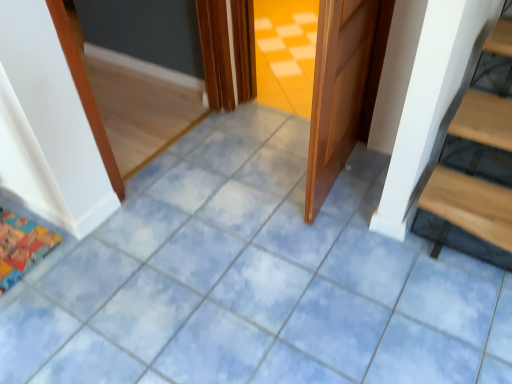
Describe the element at coordinates (21, 246) in the screenshot. The image size is (512, 384). I see `cartoon fabric mat at lower left` at that location.

The image size is (512, 384). I want to click on cartoon fabric mat at lower left, so click(21, 246).

The height and width of the screenshot is (384, 512). I want to click on brown wooden door at center, so click(340, 89).

Describe the element at coordinates (340, 89) in the screenshot. I see `brown wooden door at center` at that location.

Image resolution: width=512 pixels, height=384 pixels. I want to click on cartoon fabric mat at lower left, so click(x=21, y=246).

Considering the relative positions of brown wooden door at center and cartoon fabric mat at lower left in the image provided, is brown wooden door at center to the right of cartoon fabric mat at lower left from the viewer's perspective?

Indeed, brown wooden door at center is positioned on the right side of cartoon fabric mat at lower left.

Is the position of brown wooden door at center less distant than that of cartoon fabric mat at lower left?

Yes, the depth of brown wooden door at center is less than that of cartoon fabric mat at lower left.

Is point (333, 169) positioned after point (38, 241)?

Yes.

From the picture: From the image's perspective, is brown wooden door at center on top of cartoon fabric mat at lower left?

Yes, from the image's perspective, brown wooden door at center is above cartoon fabric mat at lower left.

From a real-world perspective, is brown wooden door at center under cartoon fabric mat at lower left?

No, from a real-world perspective, brown wooden door at center is not under cartoon fabric mat at lower left.

Can you confirm if brown wooden door at center is wider than cartoon fabric mat at lower left?

No, brown wooden door at center is not wider than cartoon fabric mat at lower left.

Which of these two, brown wooden door at center or cartoon fabric mat at lower left, stands taller?

brown wooden door at center is taller.

Does brown wooden door at center have a larger size compared to cartoon fabric mat at lower left?

Correct, brown wooden door at center is larger in size than cartoon fabric mat at lower left.

Looking at this image, do you think brown wooden door at center is within cartoon fabric mat at lower left, or outside of it?

brown wooden door at center is outside cartoon fabric mat at lower left.

Would you consider brown wooden door at center to be distant from cartoon fabric mat at lower left?

Indeed, brown wooden door at center is not near cartoon fabric mat at lower left.

From the picture: Is brown wooden door at center turned away from cartoon fabric mat at lower left?

No, brown wooden door at center is not facing away from cartoon fabric mat at lower left.

Consider the image. What's the angular difference between brown wooden door at center and cartoon fabric mat at lower left's facing directions?

There is a 86.7-degree angle between the facing directions of brown wooden door at center and cartoon fabric mat at lower left.

At what (x,y) coordinates should I click in order to perform the action: click on doormat that is under the brown wooden door at center (from a real-world perspective). Please return your answer as a coordinate pair (x, y). Image resolution: width=512 pixels, height=384 pixels. Looking at the image, I should click on (21, 246).

Considering the positions of objects cartoon fabric mat at lower left and brown wooden door at center in the image provided, who is more to the right, cartoon fabric mat at lower left or brown wooden door at center?

From the viewer's perspective, brown wooden door at center appears more on the right side.

Is the depth of cartoon fabric mat at lower left greater than that of brown wooden door at center?

Yes, cartoon fabric mat at lower left is further from the viewer.

Which is further, (34, 261) or (318, 152)?

Positioned behind is point (34, 261).

From the image's perspective, which object appears higher, cartoon fabric mat at lower left or brown wooden door at center?

brown wooden door at center appears higher in the image.

From a real-world perspective, is cartoon fabric mat at lower left over brown wooden door at center?

Actually, cartoon fabric mat at lower left is physically below brown wooden door at center in the real world.

Is cartoon fabric mat at lower left wider than brown wooden door at center?

Correct, the width of cartoon fabric mat at lower left exceeds that of brown wooden door at center.

Consider the image. Considering the sizes of objects cartoon fabric mat at lower left and brown wooden door at center in the image provided, who is taller, cartoon fabric mat at lower left or brown wooden door at center?

brown wooden door at center is taller.

Consider the image. Does cartoon fabric mat at lower left have a larger size compared to brown wooden door at center?

Incorrect, cartoon fabric mat at lower left is not larger than brown wooden door at center.

Can brown wooden door at center be found inside cartoon fabric mat at lower left?

Actually, brown wooden door at center is outside cartoon fabric mat at lower left.

Are cartoon fabric mat at lower left and brown wooden door at center beside each other?

No, cartoon fabric mat at lower left is not touching brown wooden door at center.

Looking at this image, is cartoon fabric mat at lower left positioned with its back to brown wooden door at center?

No, cartoon fabric mat at lower left is not facing away from brown wooden door at center.

There is a cartoon fabric mat at lower left. Find the location of `door above it (from a real-world perspective)`. door above it (from a real-world perspective) is located at coordinates coord(340,89).

You are a GUI agent. You are given a task and a screenshot of the screen. Output one action in this format:
    pyautogui.click(x=<x>, y=<y>)
    Task: Click on the door above the cartoon fabric mat at lower left (from the image's perspective)
    Image resolution: width=512 pixels, height=384 pixels.
    Given the screenshot: What is the action you would take?
    pyautogui.click(x=340, y=89)

Identify the location of door above the cartoon fabric mat at lower left (from a real-world perspective). Image resolution: width=512 pixels, height=384 pixels. (340, 89).